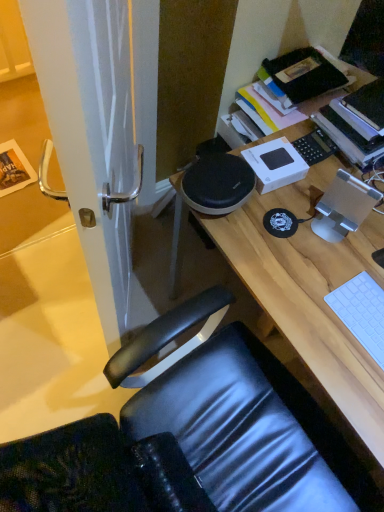
You are a GUI agent. You are given a task and a screenshot of the screen. Output one action in this format:
    pyautogui.click(x=<x>, y=<y>)
    Task: Click on the free space above white matte keyboard at lower right (from a real-world perspective)
    The image size is (384, 512).
    Given the screenshot: What is the action you would take?
    pyautogui.click(x=367, y=314)